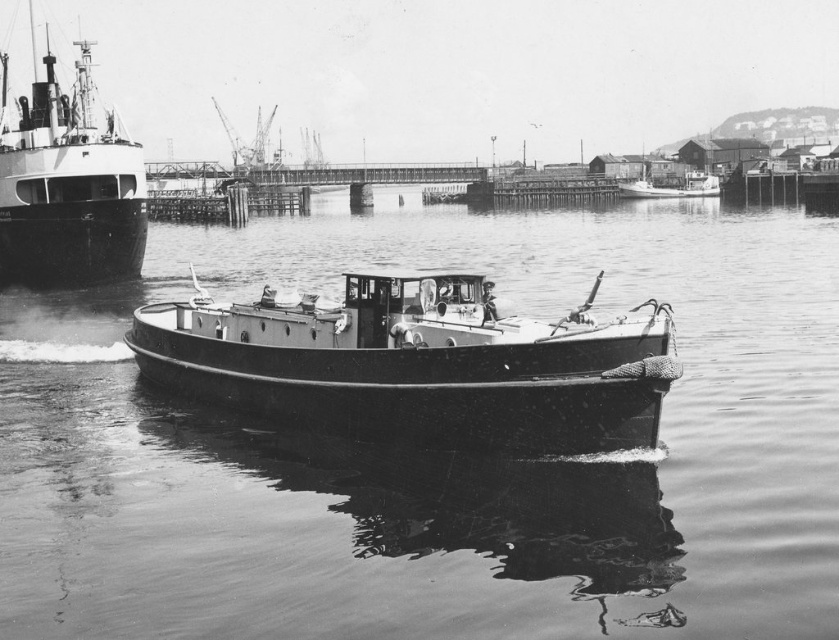
Is point (482, 506) farther from viewer compared to point (196, 364)?

No, it is not.

Is point (791, 637) positioned in front of point (525, 358)?

Yes, it is.

Locate an element on the screen. This screenshot has height=640, width=839. smooth water at center is located at coordinates (436, 456).

Who is shorter, smooth water at center or shiny black ship at left?

smooth water at center

Does smooth water at center have a larger size compared to shiny black ship at left?

No, smooth water at center is not bigger than shiny black ship at left.

Does point (404, 625) lie behind point (38, 136)?

That is False.

Where is `smooth water at center`? The image size is (839, 640). smooth water at center is located at coordinates (436, 456).

Does point (221, 310) come behind point (22, 225)?

No.

Is smooth wooden boat at center below shiny black ship at left?

Yes.

Describe the element at coordinates (420, 364) in the screenshot. This screenshot has width=839, height=640. I see `smooth wooden boat at center` at that location.

The image size is (839, 640). What are the coordinates of `smooth wooden boat at center` in the screenshot? It's located at (420, 364).